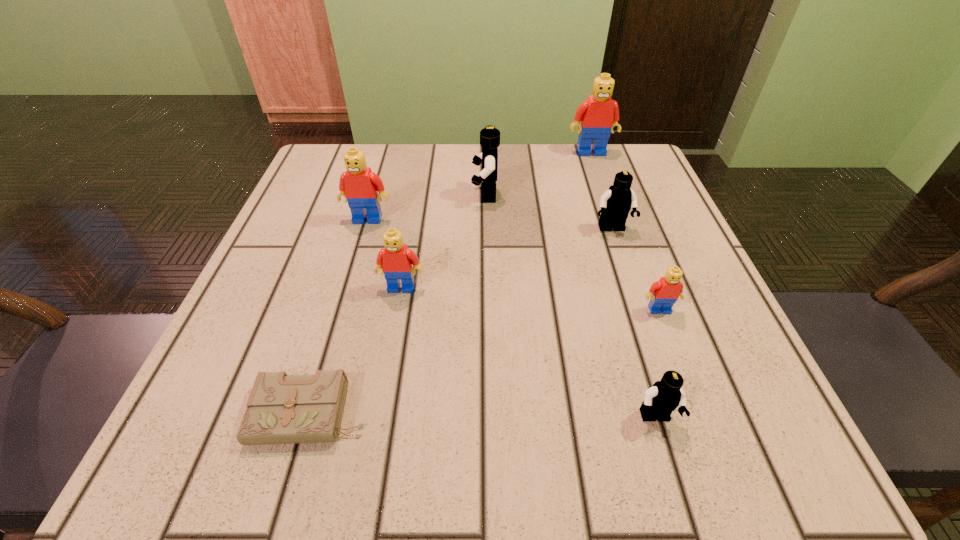
Find the location of a particular element. object situated at the near right corner is located at coordinates (664, 396).

Image resolution: width=960 pixels, height=540 pixels. What are the coordinates of `vacant space at the far edge of the desktop` in the screenshot? It's located at (419, 148).

This screenshot has width=960, height=540. What are the coordinates of `free space at the near edge of the desktop` in the screenshot? It's located at 562,427.

Where is `vacant space at the left edge of the desktop`? This screenshot has width=960, height=540. vacant space at the left edge of the desktop is located at coordinates (352, 233).

Find the location of a particular element. Image resolution: width=960 pixels, height=540 pixels. vacant space at the right edge of the desktop is located at coordinates (694, 369).

You are a GUI agent. You are given a task and a screenshot of the screen. Output one action in this format:
    pyautogui.click(x=<x>, y=<y>)
    Task: Click on the free space at the far left corner
    The height and width of the screenshot is (540, 960).
    Given the screenshot: What is the action you would take?
    pyautogui.click(x=340, y=153)

The image size is (960, 540). I want to click on free space at the far right corner, so click(x=638, y=166).

At what (x,y) coordinates should I click in order to perform the action: click on vacant region at the near right corner of the desktop. Please return your answer as a coordinate pair (x, y). Looking at the image, I should click on (785, 473).

Image resolution: width=960 pixels, height=540 pixels. In order to click on empty space that is in between the fifth farthest Lego and the nearest Lego in this screenshot , I will do coord(528,353).

The image size is (960, 540). In order to click on free space between the second nearest black Lego and the tallest Lego in this screenshot , I will do `click(601, 191)`.